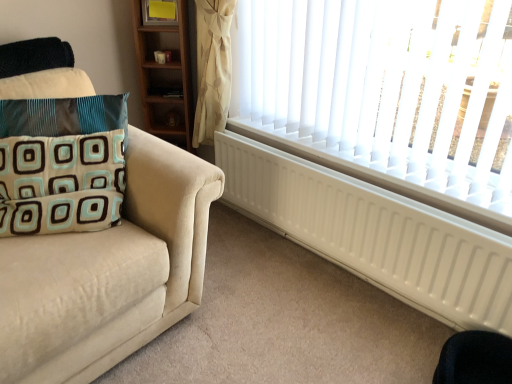
Identify the location of free point below white matte radiator at lower right (from a real-world perspective). (331, 263).